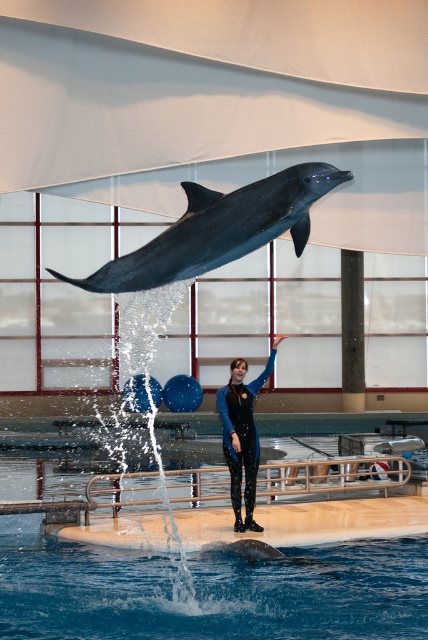
Question: Can you confirm if blue liquid water at center is positioned to the left of shiny dark blue dolphin at center?

Choices:
 (A) no
 (B) yes

Answer: (B)

Question: Which object is farther from the camera taking this photo?

Choices:
 (A) blue liquid water at center
 (B) shiny dark blue dolphin at center

Answer: (A)

Question: Does shiny dark blue dolphin at center have a larger size compared to blue rubber wetsuit at center?

Choices:
 (A) no
 (B) yes

Answer: (A)

Question: Which point is closer to the camera?

Choices:
 (A) blue liquid water at center
 (B) blue rubber wetsuit at center
 (C) shiny dark blue dolphin at center

Answer: (C)

Question: Does shiny dark blue dolphin at center have a smaller size compared to blue rubber wetsuit at center?

Choices:
 (A) no
 (B) yes

Answer: (B)

Question: Which point appears farthest from the camera in this image?

Choices:
 (A) (255, 592)
 (B) (290, 225)
 (C) (243, 456)

Answer: (C)